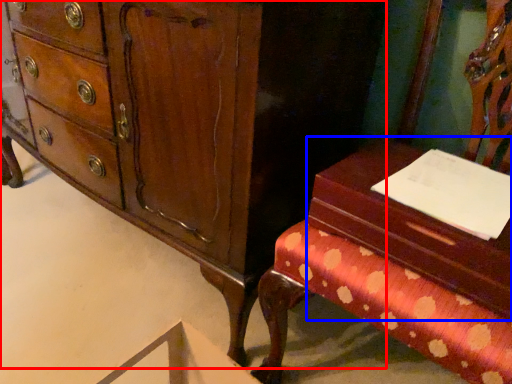
Question: Which point is further to the camera, chest of drawers (highlighted by a red box) or vanity (highlighted by a blue box)?

Choices:
 (A) chest of drawers
 (B) vanity

Answer: (A)